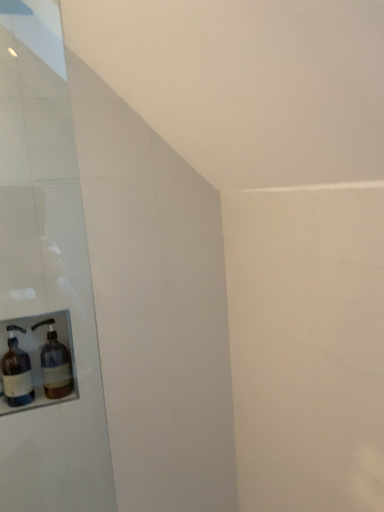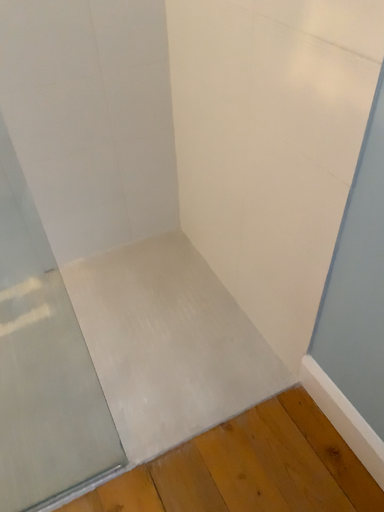
Question: Which way did the camera rotate in the video?

Choices:
 (A) rotated upward
 (B) rotated downward

Answer: (B)